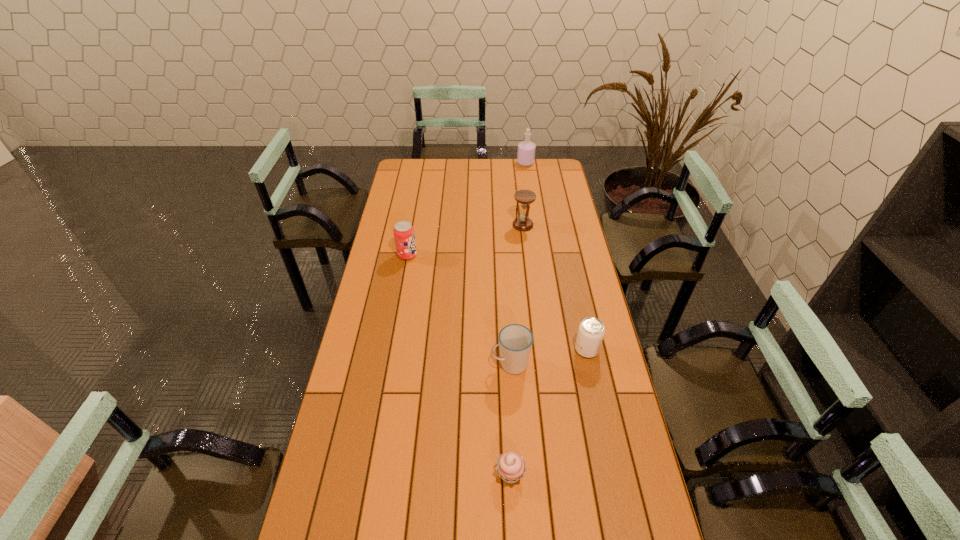
Where is `free space between the taller soda can and the cupcake`? free space between the taller soda can and the cupcake is located at coordinates (459, 364).

Where is `vacant area that lies between the cup and the cupcake`? vacant area that lies between the cup and the cupcake is located at coordinates (511, 418).

At what (x,y) coordinates should I click in order to perform the action: click on free area in between the cup and the farther soda can. Please return your answer as a coordinate pair (x, y). This screenshot has width=960, height=540. Looking at the image, I should click on (459, 309).

Locate an element on the screen. The width and height of the screenshot is (960, 540). vacant space that's between the hourglass and the rightmost object is located at coordinates (555, 287).

Identify the location of empty location between the farther soda can and the cup. The width and height of the screenshot is (960, 540). (459, 309).

Image resolution: width=960 pixels, height=540 pixels. Find the location of `empty location between the perfume and the shortest object`. empty location between the perfume and the shortest object is located at coordinates (517, 318).

Locate an element on the screen. The image size is (960, 540). object that stands as the third closest to the right soda can is located at coordinates (525, 197).

Select which object is the fourth closest to the perfume. Please provide its 2D coordinates. Your answer should be formatted as a tuple, i.e. [(x, y)], where the tuple contains the x and y coordinates of a point satisfying the conditions above.

[(515, 341)]

At what (x,y) coordinates should I click in order to perform the action: click on vacant space that satisfies the following two spatial constraints: 1. on the front side of the tallest object; 2. on the surface of the left soda can. Please return your answer as a coordinate pair (x, y). The image size is (960, 540). Looking at the image, I should click on (539, 255).

The image size is (960, 540). I want to click on free space in the image that satisfies the following two spatial constraints: 1. on the surface of the left soda can; 2. on the back side of the shortest object, so click(368, 474).